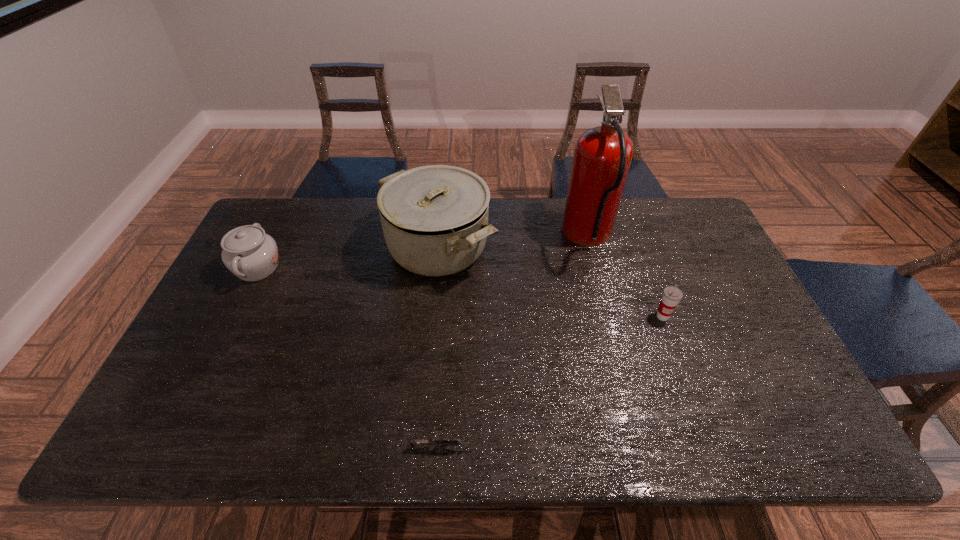
Identify the location of vacant space at the near edge of the desktop. (543, 429).

You are a GUI agent. You are given a task and a screenshot of the screen. Output one action in this format:
    pyautogui.click(x=<x>, y=<y>)
    Task: Click on the free space at the right edge of the desktop
    The height and width of the screenshot is (540, 960).
    Given the screenshot: What is the action you would take?
    pyautogui.click(x=734, y=309)

At what (x,y) coordinates should I click in order to perform the action: click on free space at the far left corner of the desktop. Please return your answer as a coordinate pair (x, y). Looking at the image, I should click on (270, 199).

Where is `free region at the far right corner`? This screenshot has width=960, height=540. free region at the far right corner is located at coordinates (665, 240).

Identify the location of empty space between the nearest object and the tallest object. (516, 342).

The width and height of the screenshot is (960, 540). I want to click on free spot between the leftmost object and the cup, so click(460, 292).

The height and width of the screenshot is (540, 960). Identify the location of vacant area that lies between the saucepan and the shortest object. (442, 347).

Locate an element on the screen. free space that is in between the chinaware and the cup is located at coordinates tap(460, 292).

I want to click on vacant space that's between the rightmost object and the gun, so click(x=553, y=382).

Locate an element on the screen. The height and width of the screenshot is (540, 960). unoccupied position between the gun and the second tallest object is located at coordinates (442, 347).